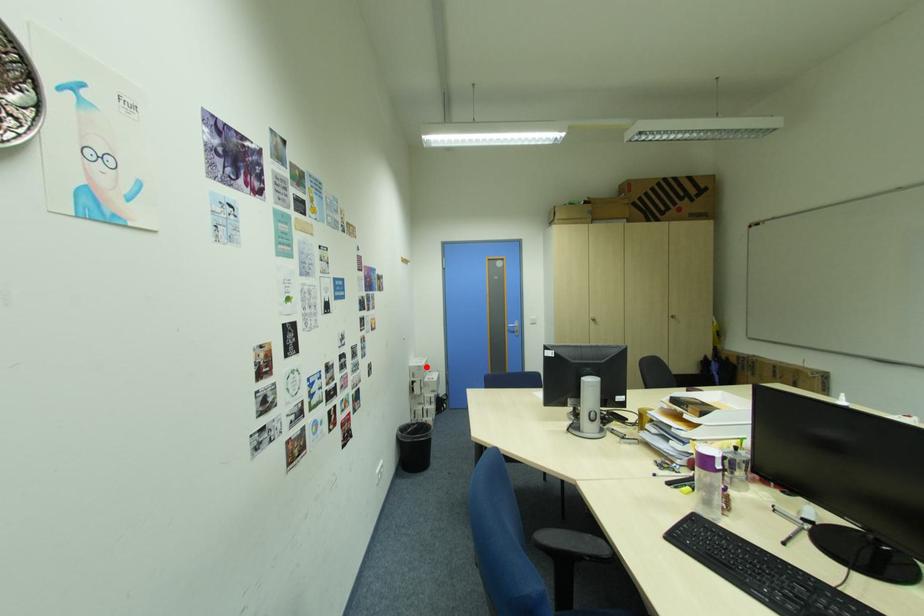
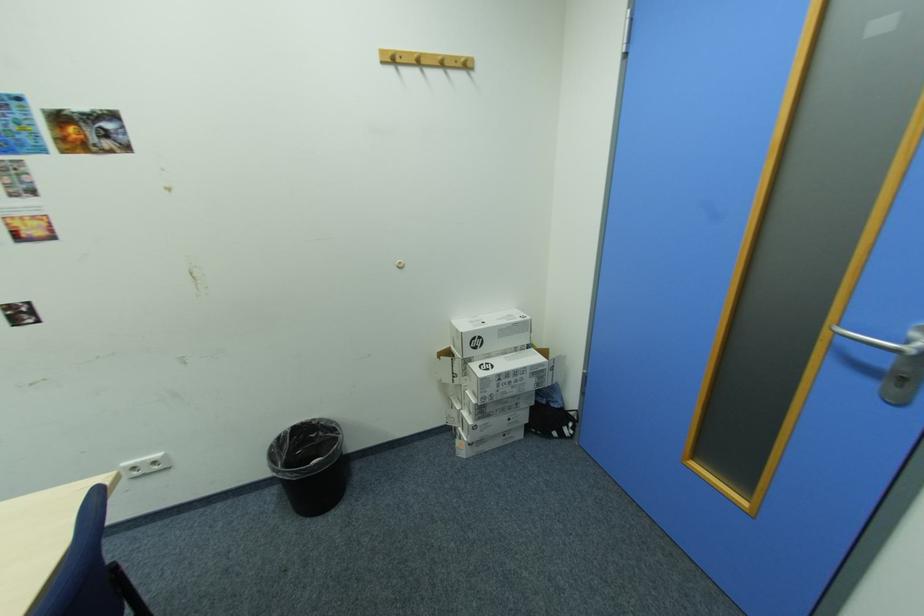
Find the pixel in the second image that matches the highlighted location in the first image.

(465, 331)